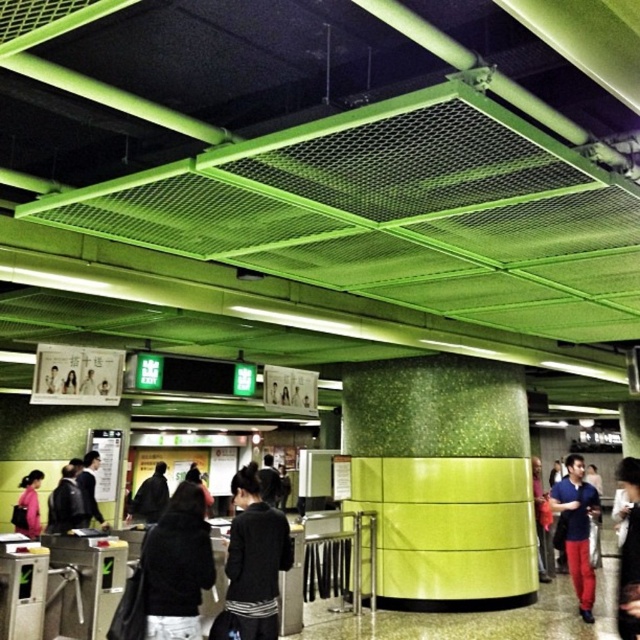
Question: Considering the real-world distances, which object is closest to the dark gray jacket at center?

Choices:
 (A) leather jacket at center
 (B) matte pink jacket at lower left
 (C) black fabric jacket at center

Answer: (A)

Question: Does dark blue t-shirt at right have a lesser width compared to dark gray fabric jacket at center?

Choices:
 (A) no
 (B) yes

Answer: (A)

Question: Among these points, which one is farthest from the camera?

Choices:
 (A) (54, 490)
 (B) (20, 513)
 (C) (252, 502)
 (D) (176, 566)

Answer: (B)

Question: Among these points, which one is nearest to the camera?

Choices:
 (A) (51, 518)
 (B) (545, 502)
 (C) (148, 518)

Answer: (A)

Question: Is the position of black fabric jacket at center more distant than that of matte pink jacket at lower left?

Choices:
 (A) no
 (B) yes

Answer: (A)

Question: Considering the relative positions of dark gray fabric jacket at center and matte pink jacket at lower left in the image provided, where is dark gray fabric jacket at center located with respect to matte pink jacket at lower left?

Choices:
 (A) left
 (B) right

Answer: (B)